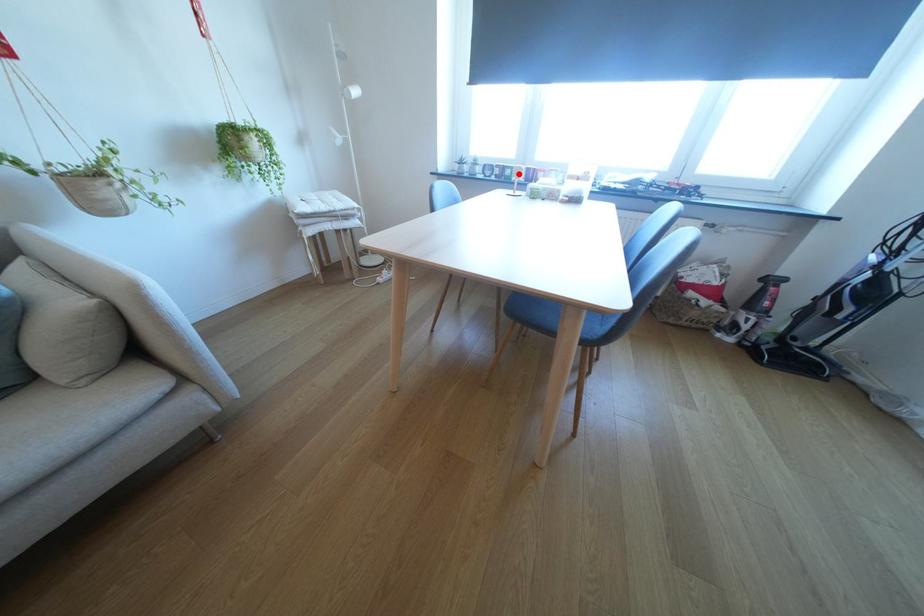
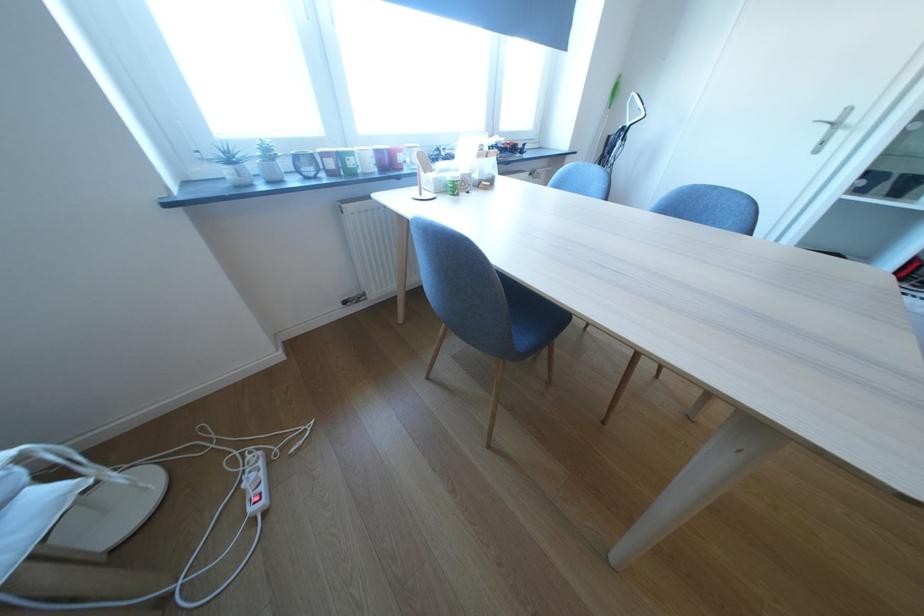
Locate, in the second image, the point that corresponds to the highlighted location in the first image.

(361, 164)